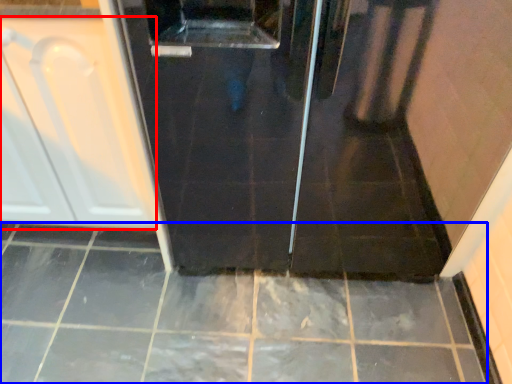
Question: Which object appears closest to the camera in this image, cabinetry (highlighted by a red box) or ceramic tile (highlighted by a blue box)?

Choices:
 (A) cabinetry
 (B) ceramic tile

Answer: (A)